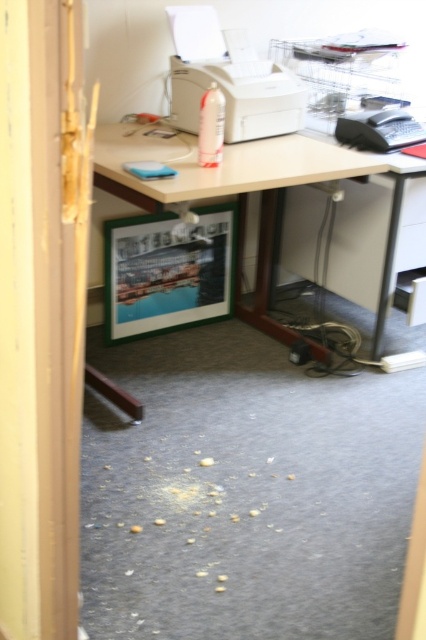
Consider the image. Is wooden desk at center smaller than black plastic telephone at right?

No, wooden desk at center is not smaller than black plastic telephone at right.

Which is above, wooden desk at center or black plastic telephone at right?

Positioned higher is black plastic telephone at right.

Image resolution: width=426 pixels, height=640 pixels. I want to click on wooden desk at center, so click(x=226, y=180).

Between wooden desk at center and white plastic printer at center, which one is positioned higher?

white plastic printer at center

Is point (285, 182) positioned in front of point (186, 28)?

Yes, point (285, 182) is closer to viewer.

Is point (331, 172) less distant than point (172, 118)?

Yes.

Locate an element on the screen. This screenshot has height=640, width=426. wooden desk at center is located at coordinates (226, 180).

In order to click on white plastic printer at center in this screenshot , I will do `click(229, 77)`.

Between point (184, 29) and point (383, 144), which one is positioned in front?

Point (184, 29) is in front.

Where is `white plastic printer at center`? white plastic printer at center is located at coordinates (229, 77).